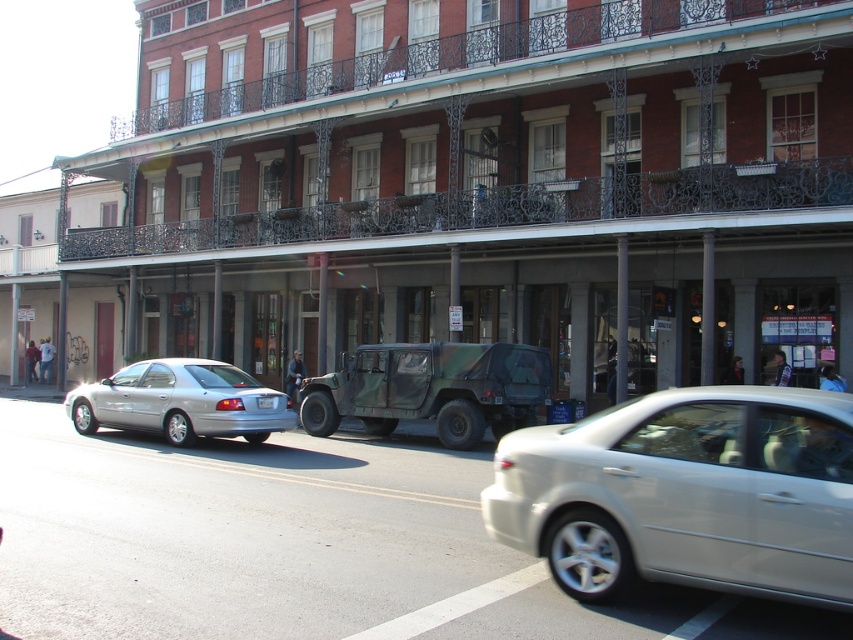
Question: Which object appears closest to the camera in this image?

Choices:
 (A) silver metallic sedan at center
 (B) camouflage fabric jeep at center

Answer: (A)

Question: Where is silver metallic sedan at center located in relation to camouflage fabric jeep at center in the image?

Choices:
 (A) above
 (B) below

Answer: (A)

Question: Considering the real-world distances, which object is closest to the silver metallic sedan at center?

Choices:
 (A) camouflage fabric jeep at center
 (B) silver metallic sedan at left

Answer: (B)

Question: Which object is the closest to the silver metallic sedan at center?

Choices:
 (A) camouflage fabric jeep at center
 (B) silver metallic sedan at left

Answer: (B)

Question: Can you confirm if silver metallic sedan at center is smaller than camouflage fabric jeep at center?

Choices:
 (A) no
 (B) yes

Answer: (B)

Question: Is silver metallic sedan at center further to the viewer compared to camouflage fabric jeep at center?

Choices:
 (A) yes
 (B) no

Answer: (B)